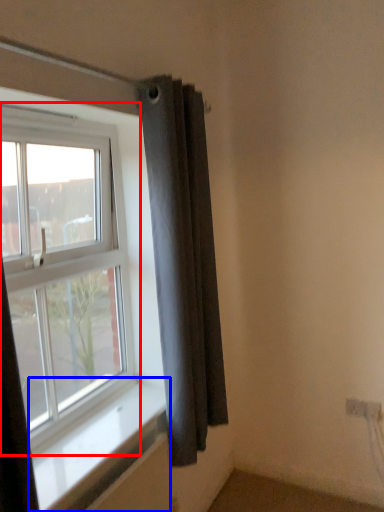
Question: Which object appears closest to the camera in this image, window (highlighted by a red box) or window sill (highlighted by a blue box)?

Choices:
 (A) window
 (B) window sill

Answer: (B)